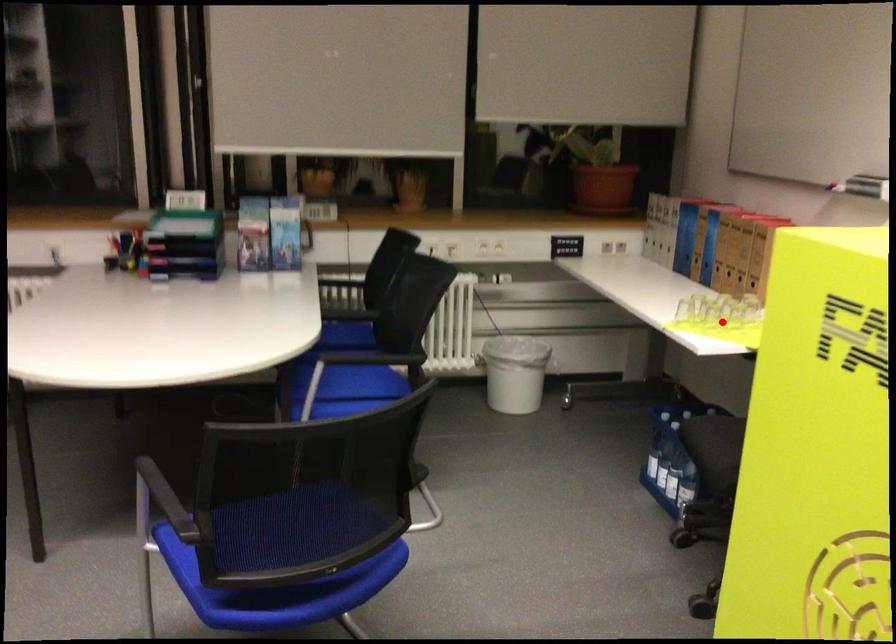
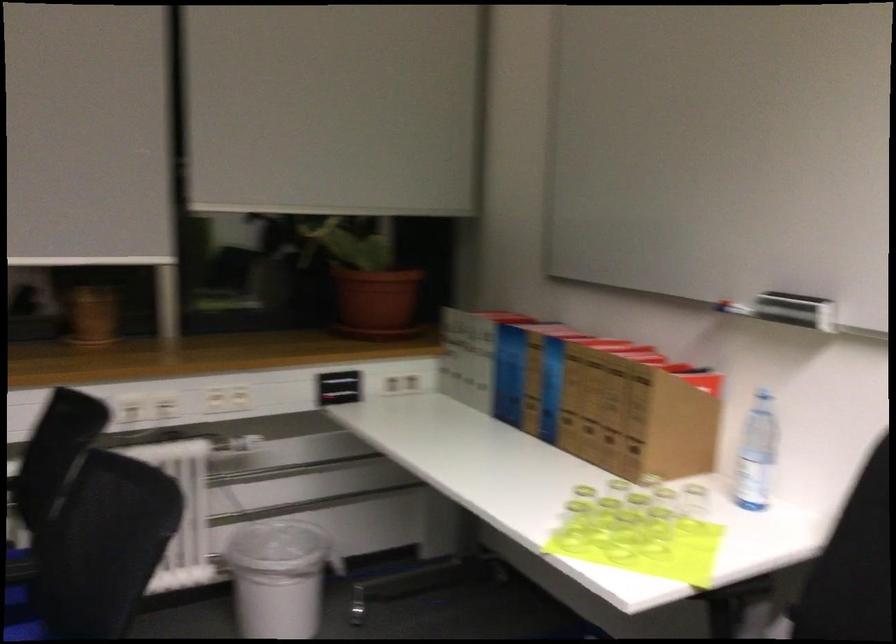
Question: A red point is marked in image1. In image2, is the corresponding 3D point closer to the camera or farther? Reply with the corresponding letter.

Choices:
 (A) The corresponding 3D point is closer.
 (B) The corresponding 3D point is farther.

Answer: (A)